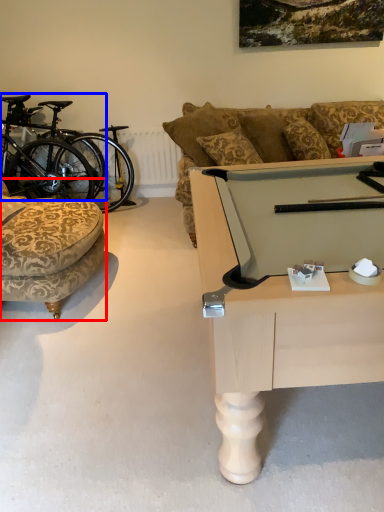
Question: Which object is closer to the camera taking this photo, chair (highlighted by a red box) or bicycle (highlighted by a blue box)?

Choices:
 (A) chair
 (B) bicycle

Answer: (A)